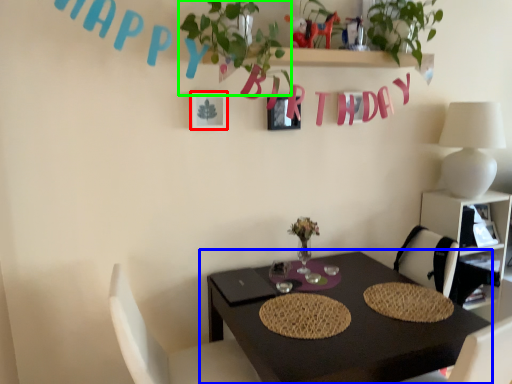
Question: Considering the real-world distances, which object is closest to picture frame (highlighted by a red box)? table (highlighted by a blue box) or plant (highlighted by a green box).

Choices:
 (A) table
 (B) plant

Answer: (B)